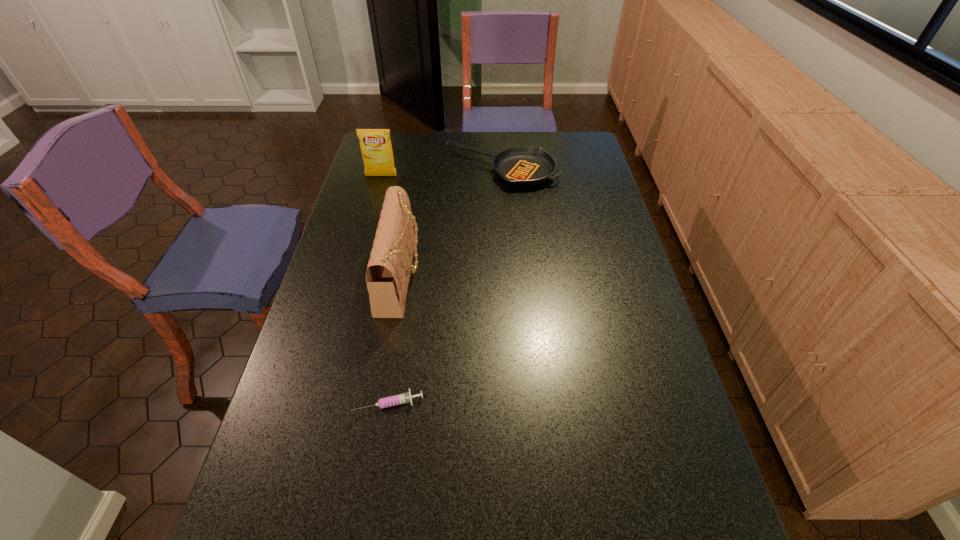
Image resolution: width=960 pixels, height=540 pixels. Identify the location of handbag. (388, 271).

You are a GUI agent. You are given a task and a screenshot of the screen. Output one action in this format:
    pyautogui.click(x=<x>, y=<y>)
    Task: Click on the leftmost object
    
    Given the screenshot: What is the action you would take?
    pyautogui.click(x=376, y=148)

The height and width of the screenshot is (540, 960). I want to click on frying pan, so click(x=525, y=166).

At what (x,y) coordinates should I click in order to perform the action: click on the nearest object. Please return your answer as a coordinate pair (x, y). Looking at the image, I should click on (403, 398).

The image size is (960, 540). Identify the location of the shortest object. (403, 398).

In order to click on blank area located 0.350m on the front-facing side of the handbag in this screenshot , I will do `click(540, 275)`.

Find the location of `vacant space located on the front of the leftmost object with the logo`. vacant space located on the front of the leftmost object with the logo is located at coordinates (374, 201).

Locate an element on the screen. vacant region located 0.110m on the front of the frying pan is located at coordinates (503, 210).

What are the coordinates of `vacant space positioned on the right of the nearest object` in the screenshot? It's located at click(501, 402).

Identify the location of object positioned at the far edge. (525, 166).